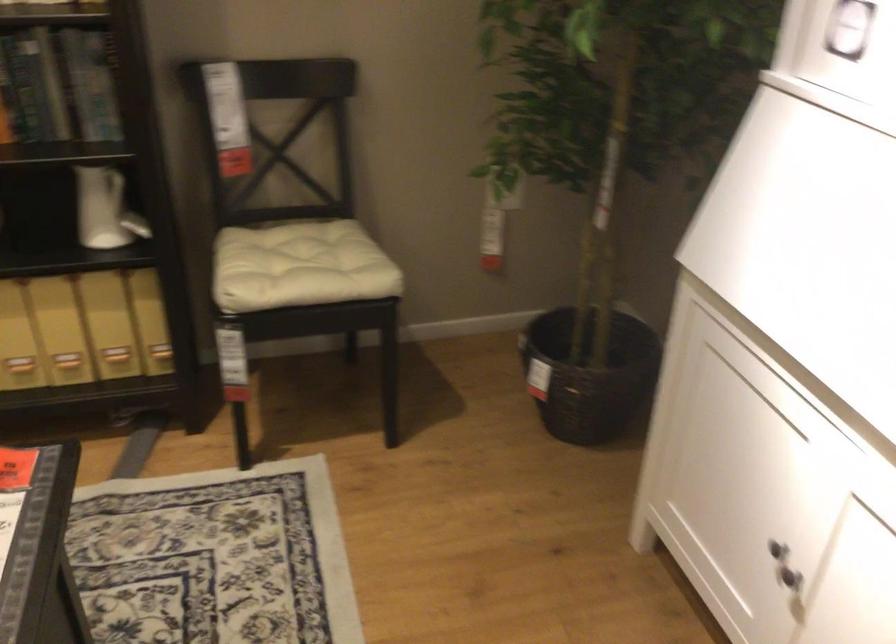
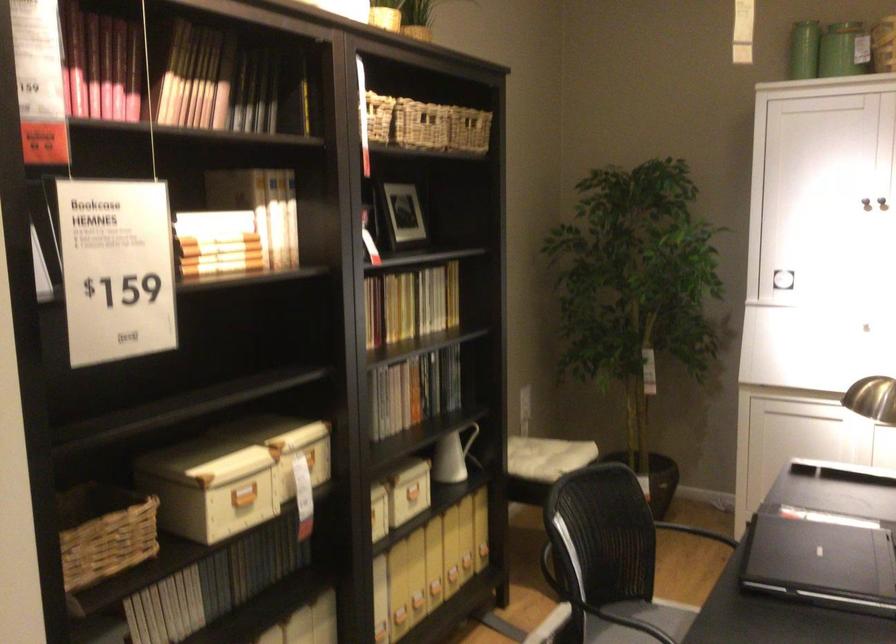
Find the pixel in the second image that matches point 736,247 in the first image.

(791, 351)